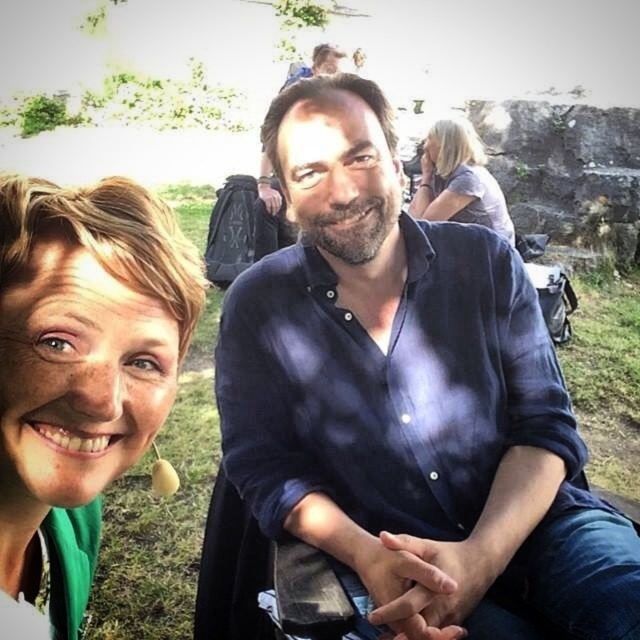
In the scene, there is a green fabric at left and a blonde hair at upper right. Which object is located lower in the image?

The green fabric at left is positioned under blonde hair at upper right, so the green fabric at left is lower than the blonde hair at upper right.

What is the 2D coordinate of the green fabric at left in the image?

The 2D coordinate of the green fabric at left is at point (81,369).

You are a photographer setting up a shot of the two people in the scene. You need to ensure that the blue cotton shirt at center and the green fabric at left are both visible in the frame. Given their sizes, which object will require more space horizontally in the composition?

The blue cotton shirt at center requires more horizontal space in the composition because its width surpasses that of the green fabric at left.